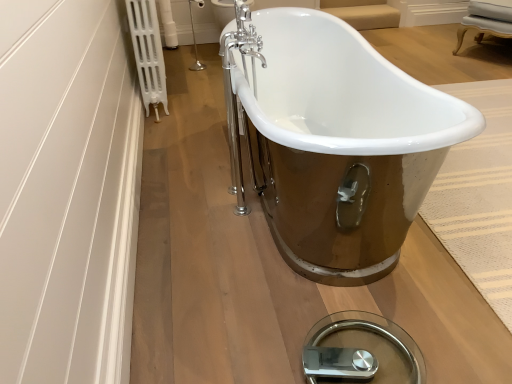
Question: From the image's perspective, relative to white plastic radiator at upper left, is chrome metallic faucet at upper center above or below?

Choices:
 (A) above
 (B) below

Answer: (A)

Question: From their relative heights in the image, would you say chrome metallic faucet at upper center is taller or shorter than white plastic radiator at upper left?

Choices:
 (A) tall
 (B) short

Answer: (B)

Question: Estimate the real-world distances between objects in this image. Which object is closer to the chrome metallic faucet at upper center?

Choices:
 (A) white plastic radiator at upper left
 (B) white porcelain bathtub at center

Answer: (A)

Question: Estimate the real-world distances between objects in this image. Which object is closer to the white plastic radiator at upper left?

Choices:
 (A) chrome metallic faucet at upper center
 (B) white porcelain bathtub at center

Answer: (B)